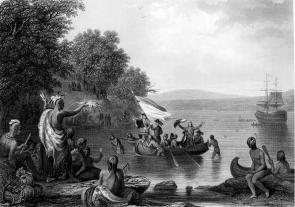
You are a GUI agent. You are given a task and a screenshot of the screen. Output one action in this format:
    pyautogui.click(x=<x>, y=<y>)
    Task: Click on the painting
    
    Given the screenshot: What is the action you would take?
    pyautogui.click(x=188, y=106)